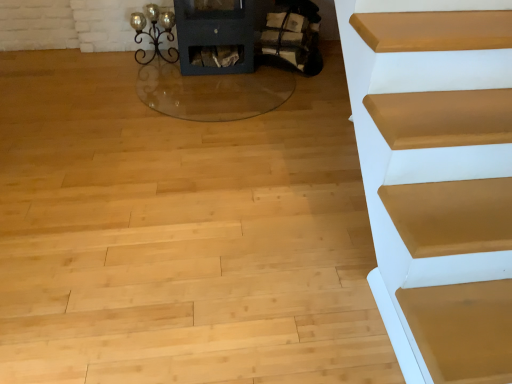
Image resolution: width=512 pixels, height=384 pixels. Identify the location of vacant space in front of wooden logs at center. (285, 95).